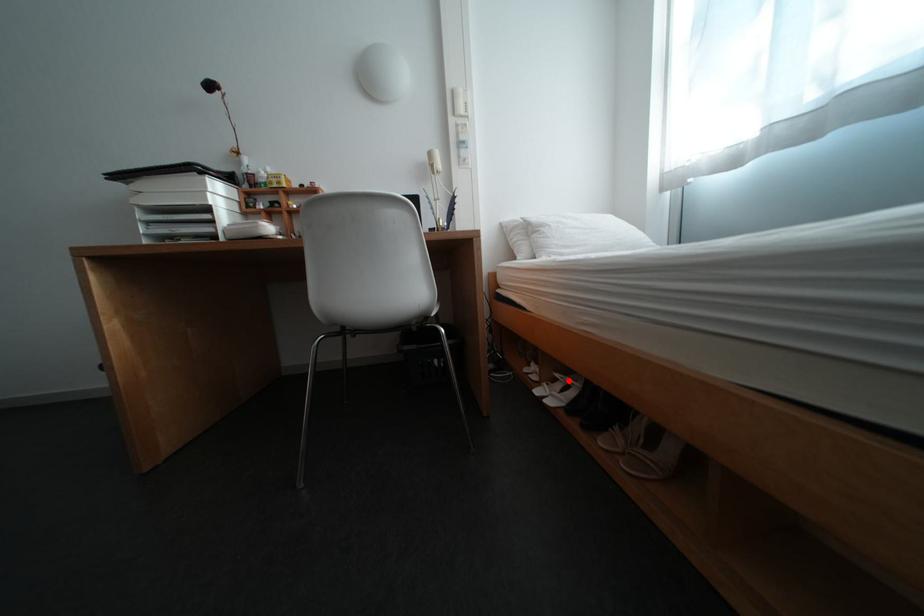
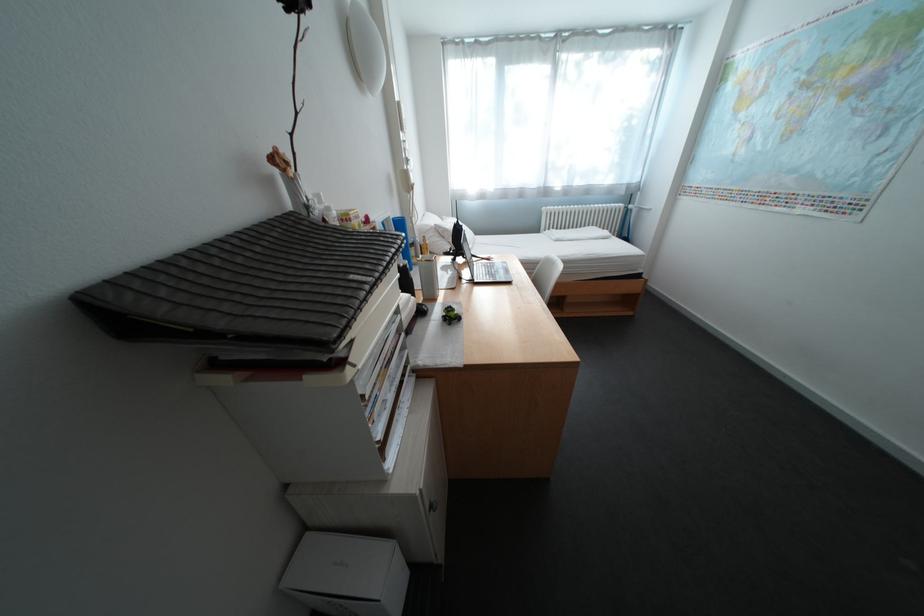
Question: I am providing you with two images of the same scene from different viewpoints. A red point is marked on the first image. At the location where the point appears in image 1, is it still visible in image 2?

Choices:
 (A) Yes
 (B) No

Answer: (B)